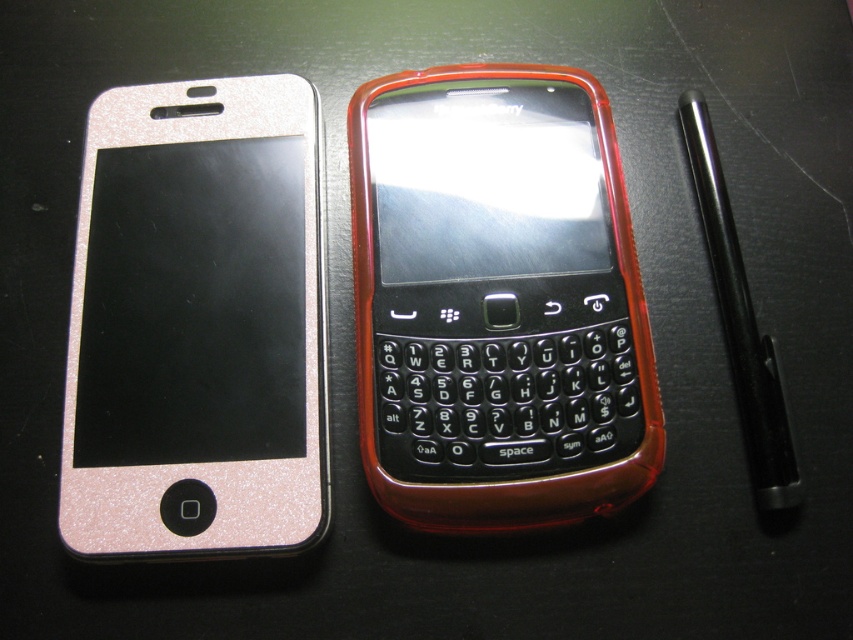
You are organizing items on a desk and need to place a new item between the glittery rose gold phone at left and the black metallic pen at right. Based on their positions, where should you place the new item?

The glittery rose gold phone at left is located below the black metallic pen at right, so you should place the new item between them horizontally, ensuring it is positioned above the glittery rose gold phone at left and below the black metallic pen at right.

You are holding a black metallic pen at right and want to place it closer to the glittery rose gold phone at left. However, you need to ensure that the pen doesn not touch the phone. Based on their current positions, is there enough space between them for you to move the pen closer without touching?

The glittery rose gold phone at left is closer to the viewer than the black metallic pen at right. Therefore, moving the pen closer would require adjusting its position along the depth axis. Since the phone is nearer, there is space between them in the depth direction, so you can move the pen forward towards the phone without touching it as long as you maintain horizontal separation.